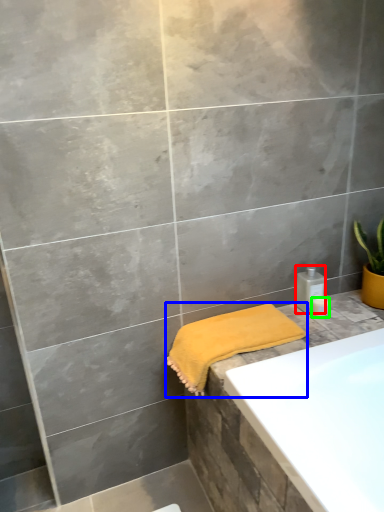
Question: Estimate the real-world distances between objects in this image. Which object is closer to toiletry (highlighted by a red box), towel (highlighted by a blue box) or toiletry (highlighted by a green box)?

Choices:
 (A) towel
 (B) toiletry

Answer: (B)